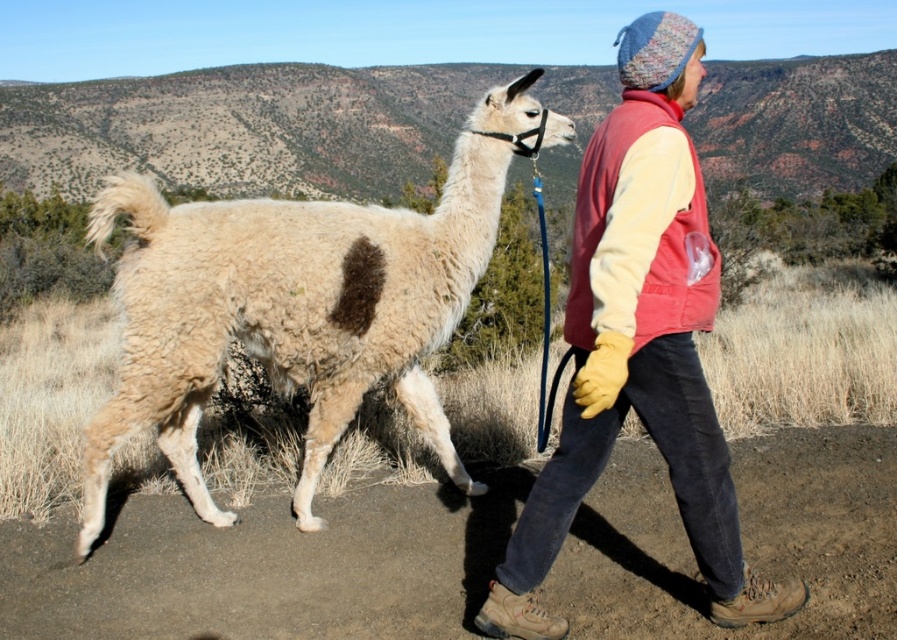
Question: Which point is closer to the camera taking this photo?

Choices:
 (A) (155, 220)
 (B) (647, 96)

Answer: (B)

Question: Which point appears closest to the camera in this image?

Choices:
 (A) (571, 310)
 (B) (321, 243)

Answer: (A)

Question: Can you confirm if white woolen alpaca at center is positioned below knitted wool hat at upper right?

Choices:
 (A) no
 (B) yes

Answer: (B)

Question: Is white woolen alpaca at center to the left of knitted wool hat at upper right from the viewer's perspective?

Choices:
 (A) yes
 (B) no

Answer: (A)

Question: Which point is farther from the camera taking this photo?

Choices:
 (A) (725, 525)
 (B) (135, 218)

Answer: (B)

Question: From the image, what is the correct spatial relationship of white woolen alpaca at center in relation to knitted wool hat at upper right?

Choices:
 (A) right
 (B) left

Answer: (B)